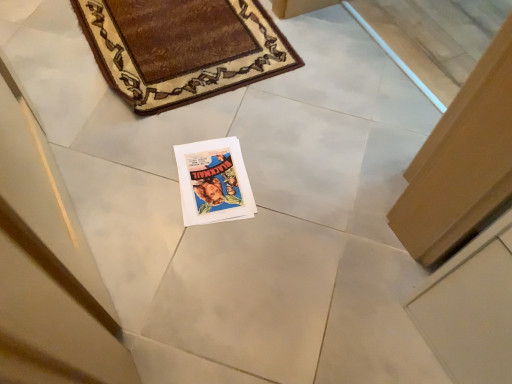
This screenshot has width=512, height=384. Identify the location of matte paper magazine at center. (213, 182).

The image size is (512, 384). What do you see at coordinates (213, 182) in the screenshot?
I see `matte paper magazine at center` at bounding box center [213, 182].

In order to face matte paper magazine at center, should I rotate leftwards or rightwards?

You should look left and rotate roughly 5.466 degrees.

Find the location of a particular element. This screenshot has width=512, height=384. matte paper magazine at center is located at coordinates (213, 182).